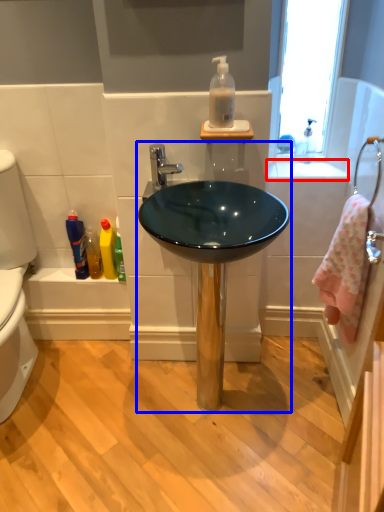
Question: Which of the following is the farthest to the observer, counter top (highlighted by a red box) or sink (highlighted by a blue box)?

Choices:
 (A) counter top
 (B) sink

Answer: (A)